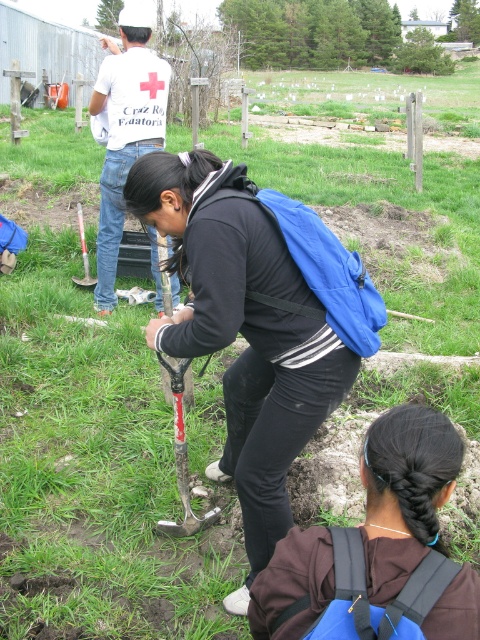
Question: Among these objects, which one is farthest from the camera?

Choices:
 (A) white cotton shirt at upper center
 (B) blue backpack at lower center
 (C) red plastic shovel at center

Answer: (C)

Question: Does blue fabric backpack at center lie in front of blue backpack at lower center?

Choices:
 (A) yes
 (B) no

Answer: (B)

Question: Can you confirm if white cotton shirt at upper center is positioned to the left of rusty metal shovel at center?

Choices:
 (A) no
 (B) yes

Answer: (B)

Question: Does blue backpack at lower center have a smaller size compared to white cotton shirt at upper center?

Choices:
 (A) no
 (B) yes

Answer: (B)

Question: Which is nearer to the blue fabric backpack at center?

Choices:
 (A) blue backpack at lower center
 (B) red plastic shovel at center
 (C) rusty metal shovel at center

Answer: (C)

Question: Estimate the real-world distances between objects in this image. Which object is closer to the white cotton shirt at upper center?

Choices:
 (A) blue fabric backpack at center
 (B) blue backpack at lower center

Answer: (A)